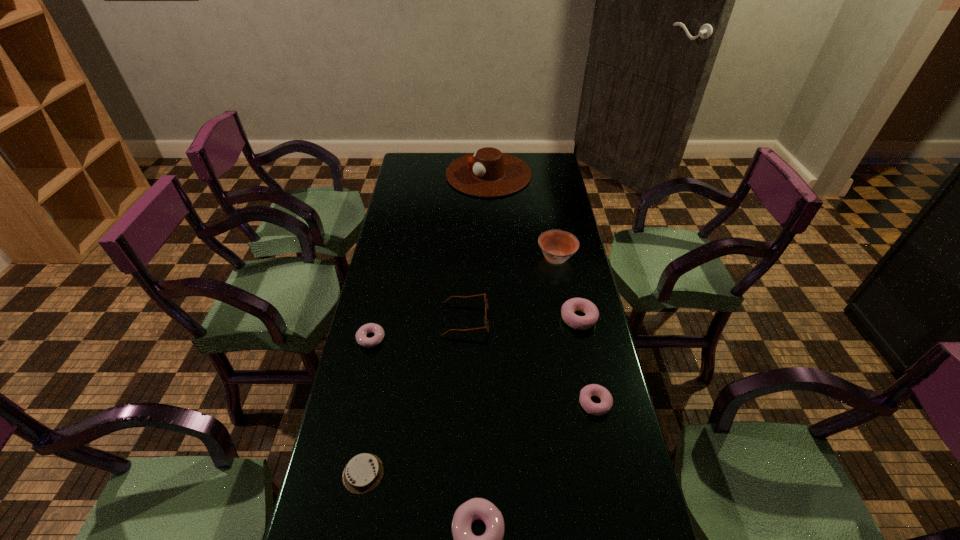
Identify the location of the farthest object. The image size is (960, 540). (488, 172).

Identify the location of the tallest object. This screenshot has height=540, width=960. (488, 172).

The width and height of the screenshot is (960, 540). Identify the location of the seventh shortest object. (557, 246).

You are a GUI agent. You are given a task and a screenshot of the screen. Output one action in this format:
    pyautogui.click(x=<x>, y=<y>)
    Task: Click on the bowl
    The height and width of the screenshot is (540, 960).
    Given the screenshot: What is the action you would take?
    pyautogui.click(x=557, y=246)

In order to click on spectacles in this screenshot , I will do `click(486, 327)`.

Where is `the farther pink doughnut`? the farther pink doughnut is located at coordinates (570, 306).

At what (x,y) coordinates should I click in order to perform the action: click on the sixth farthest object. Please return your answer as a coordinate pair (x, y). This screenshot has width=960, height=540. Looking at the image, I should click on (597, 409).

Identify the location of the nearer pink doughnut. (597, 409).

Locate an element on the screen. The width and height of the screenshot is (960, 540). the leftmost doughnut is located at coordinates (361, 335).

Where is `the smaller purple doughnut`? the smaller purple doughnut is located at coordinates (361, 335).